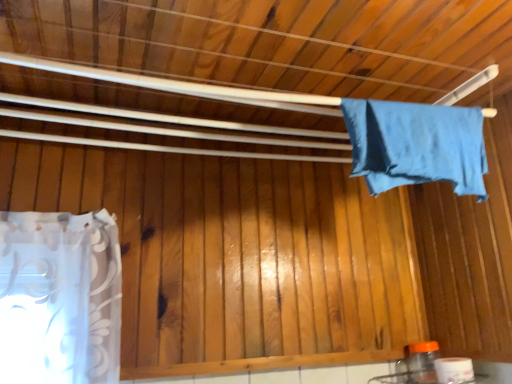
Image resolution: width=512 pixels, height=384 pixels. What are the coordinates of `white glossy toilet paper at lower right` in the screenshot? It's located at (454, 370).

What do you see at coordinates (454, 370) in the screenshot? I see `white glossy toilet paper at lower right` at bounding box center [454, 370].

What is the approximate height of blue fabric at upper right?

blue fabric at upper right is 9.48 inches tall.

Describe the element at coordinates (416, 145) in the screenshot. I see `blue fabric at upper right` at that location.

I want to click on blue fabric at upper right, so click(416, 145).

Where is `white glossy toilet paper at lower right`? The image size is (512, 384). white glossy toilet paper at lower right is located at coordinates (454, 370).

Which object is positioned more to the left, white glossy toilet paper at lower right or blue fabric at upper right?

From the viewer's perspective, blue fabric at upper right appears more on the left side.

Does white glossy toilet paper at lower right come in front of blue fabric at upper right?

No, white glossy toilet paper at lower right is further to the viewer.

Which is closer, (455,372) or (468,177)?

Point (455,372) is farther from the camera than point (468,177).

From the image's perspective, is white glossy toilet paper at lower right below blue fabric at upper right?

Yes, from the image's perspective, white glossy toilet paper at lower right is below blue fabric at upper right.

From a real-world perspective, relative to blue fabric at upper right, is white glossy toilet paper at lower right vertically above or below?

Clearly, from a real-world perspective, white glossy toilet paper at lower right is below blue fabric at upper right.

Can you confirm if white glossy toilet paper at lower right is wider than blue fabric at upper right?

In fact, white glossy toilet paper at lower right might be narrower than blue fabric at upper right.

Considering the sizes of white glossy toilet paper at lower right and blue fabric at upper right in the image, is white glossy toilet paper at lower right taller or shorter than blue fabric at upper right?

In the image, white glossy toilet paper at lower right appears to be shorter than blue fabric at upper right.

Can you confirm if white glossy toilet paper at lower right is smaller than blue fabric at upper right?

Correct, white glossy toilet paper at lower right occupies less space than blue fabric at upper right.

Would you say white glossy toilet paper at lower right is outside blue fabric at upper right?

white glossy toilet paper at lower right lies outside blue fabric at upper right's area.

Is white glossy toilet paper at lower right not near blue fabric at upper right?

They are positioned close to each other.

Is white glossy toilet paper at lower right facing away from blue fabric at upper right?

white glossy toilet paper at lower right does not have its back to blue fabric at upper right.

You are a GUI agent. You are given a task and a screenshot of the screen. Output one action in this format:
    pyautogui.click(x=<x>, y=<y>)
    Task: Click on the towel that appears above the white glossy toilet paper at lower right (from the image's perspective)
    The height and width of the screenshot is (384, 512).
    Given the screenshot: What is the action you would take?
    pyautogui.click(x=416, y=145)

Considering the relative positions of blue fabric at upper right and white glossy toilet paper at lower right in the image provided, is blue fabric at upper right to the left of white glossy toilet paper at lower right from the viewer's perspective?

Correct, you'll find blue fabric at upper right to the left of white glossy toilet paper at lower right.

Considering their positions, is blue fabric at upper right located in front of or behind white glossy toilet paper at lower right?

Visually, blue fabric at upper right is located in front of white glossy toilet paper at lower right.

Considering the positions of points (481, 114) and (446, 382), is point (481, 114) farther from camera compared to point (446, 382)?

No.

From the image's perspective, who appears lower, blue fabric at upper right or white glossy toilet paper at lower right?

white glossy toilet paper at lower right, from the image's perspective.

From a real-world perspective, who is located higher, blue fabric at upper right or white glossy toilet paper at lower right?

From a 3D spatial view, blue fabric at upper right is above.

Does blue fabric at upper right have a lesser width compared to white glossy toilet paper at lower right?

Incorrect, the width of blue fabric at upper right is not less than that of white glossy toilet paper at lower right.

From the picture: Does blue fabric at upper right have a greater height compared to white glossy toilet paper at lower right?

Correct, blue fabric at upper right is much taller as white glossy toilet paper at lower right.

Considering the relative sizes of blue fabric at upper right and white glossy toilet paper at lower right in the image provided, is blue fabric at upper right bigger than white glossy toilet paper at lower right?

Indeed, blue fabric at upper right has a larger size compared to white glossy toilet paper at lower right.

Is white glossy toilet paper at lower right completely or partially inside blue fabric at upper right?

That's incorrect, white glossy toilet paper at lower right is not inside blue fabric at upper right.

Is blue fabric at upper right in contact with white glossy toilet paper at lower right?

No.

Is blue fabric at upper right facing away from white glossy toilet paper at lower right?

No, blue fabric at upper right's orientation is not away from white glossy toilet paper at lower right.

What's the angular difference between blue fabric at upper right and white glossy toilet paper at lower right's facing directions?

The angle between the facing direction of blue fabric at upper right and the facing direction of white glossy toilet paper at lower right is 92.8 degrees.

This screenshot has height=384, width=512. What are the coordinates of `towel above the white glossy toilet paper at lower right (from the image's perspective)` in the screenshot? It's located at (416, 145).

You are a GUI agent. You are given a task and a screenshot of the screen. Output one action in this format:
    pyautogui.click(x=<x>, y=<y>)
    Task: Click on the toilet paper located on the right of blue fabric at upper right
    The height and width of the screenshot is (384, 512).
    Given the screenshot: What is the action you would take?
    pyautogui.click(x=454, y=370)

Where is `towel located on the left of white glossy toilet paper at lower right`? The image size is (512, 384). towel located on the left of white glossy toilet paper at lower right is located at coordinates pos(416,145).